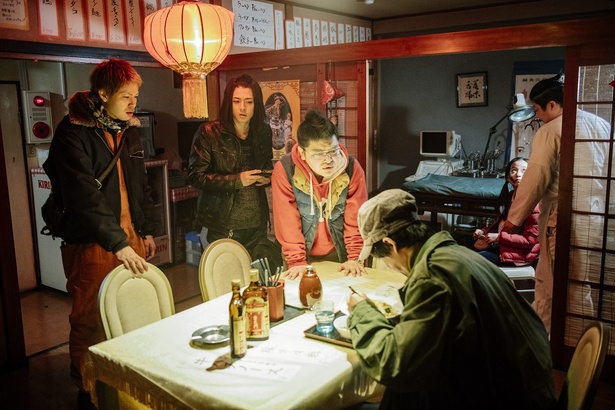
I want to click on glass bottles, so click(x=263, y=314), click(x=236, y=320).